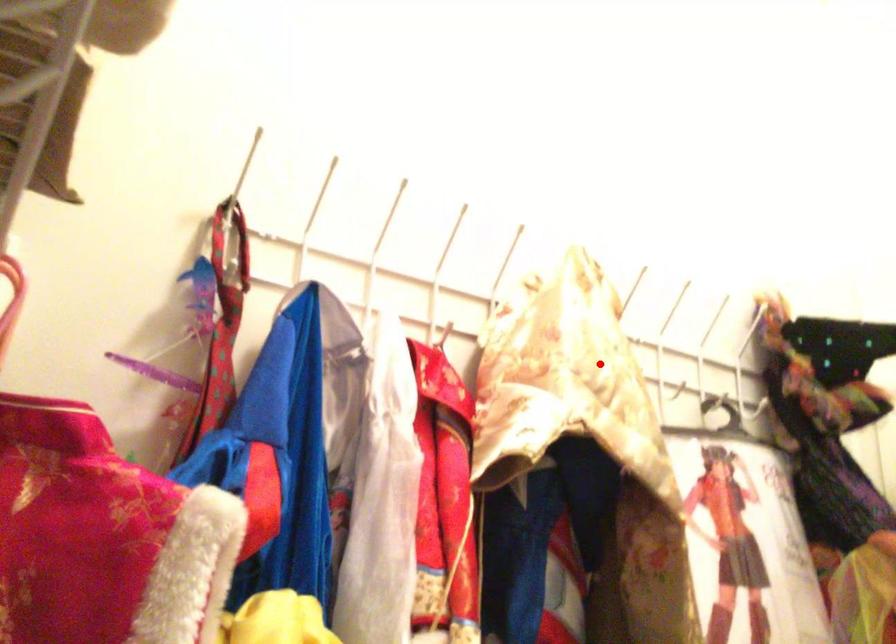
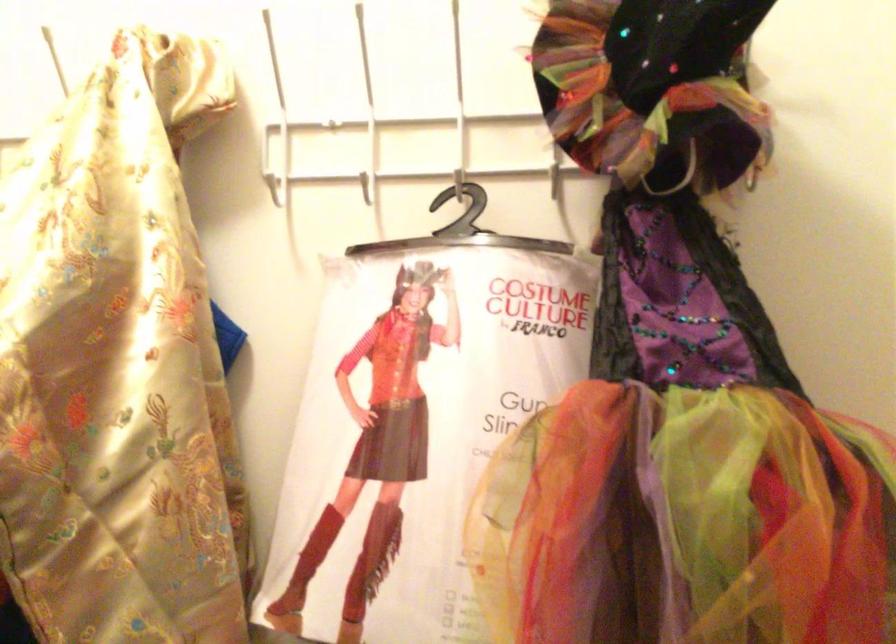
Question: A red point is marked in image1. In image2, is the corresponding 3D point closer to the camera or farther? Reply with the corresponding letter.

Choices:
 (A) The corresponding 3D point is closer.
 (B) The corresponding 3D point is farther.

Answer: (A)